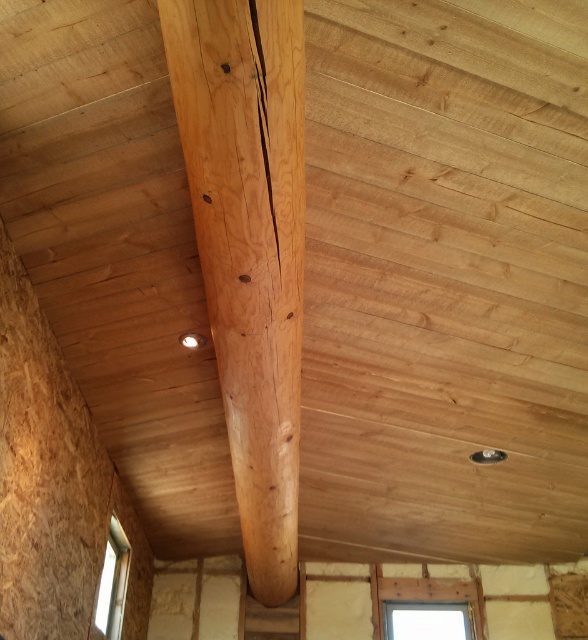
You are standing in the room and looking up at the ceiling. There are two points marked on the ceiling labeled as point (466,628) and point (115,570). Which point appears closer to you?

Point (466,628) is further to the camera than point (115,570), so the point that appears closer to you is point (115,570).

You are standing in the rustic building and want to let in more natural light. Which window, the clear glass window at center or the clear glass window at lower left, should you open to allow more light in?

The clear glass window at lower left is larger in size compared to the clear glass window at center, so opening the clear glass window at lower left would allow more natural light into the space.

You are standing in the room and looking up at the ceiling. There are two points marked on the ceiling at coordinates point [175,36] and point [108,579]. Which point is closer to your eyes?

Point [175,36] is closer to the camera than point [108,579], so the point closer to your eyes is point [175,36].